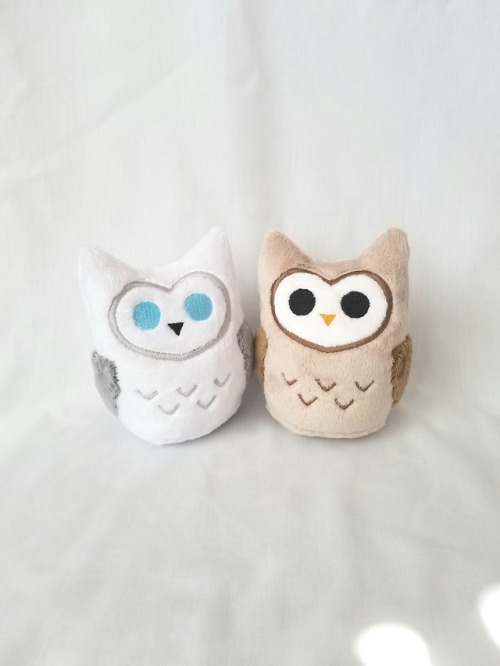
Locate an element on the screen. stuffed owl toy is located at coordinates (327, 400), (194, 383).